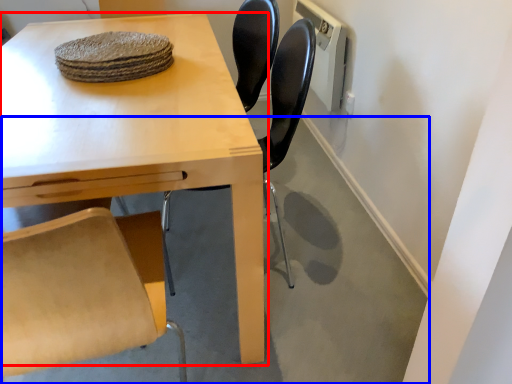
Question: Which point is closer to the camera, table (highlighted by a red box) or concrete (highlighted by a blue box)?

Choices:
 (A) table
 (B) concrete

Answer: (A)